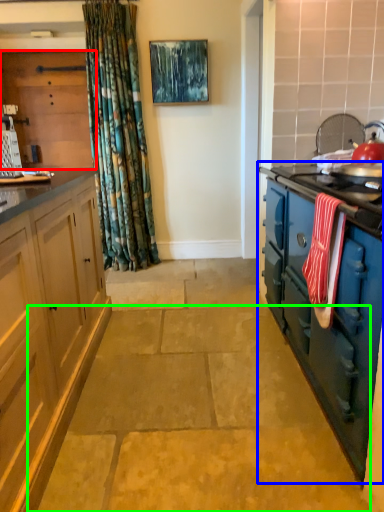
Question: Considering the real-world distances, which object is farthest from cabinetry (highlighted by a red box)? cabinetry (highlighted by a blue box) or concrete (highlighted by a green box)?

Choices:
 (A) cabinetry
 (B) concrete

Answer: (B)